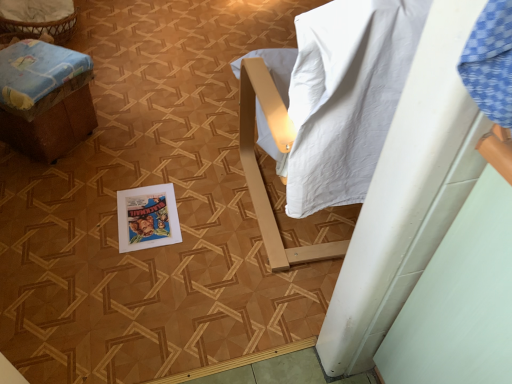
Question: Is point (125, 226) closer or farther from the camera than point (62, 122)?

Choices:
 (A) farther
 (B) closer

Answer: (B)

Question: Looking at their shapes, would you say vivid poster at center is wider or thinner than brown cardboard box at left?

Choices:
 (A) thin
 (B) wide

Answer: (A)

Question: Relative to brown cardboard box at left, is vivid poster at center in front or behind?

Choices:
 (A) behind
 (B) front

Answer: (A)

Question: Visually, is brown cardboard box at left positioned to the left or to the right of vivid poster at center?

Choices:
 (A) right
 (B) left

Answer: (B)

Question: Considering their positions, is brown cardboard box at left located in front of or behind vivid poster at center?

Choices:
 (A) front
 (B) behind

Answer: (A)

Question: From their relative heights in the image, would you say brown cardboard box at left is taller or shorter than vivid poster at center?

Choices:
 (A) tall
 (B) short

Answer: (A)

Question: Considering the positions of brown cardboard box at left and vivid poster at center in the image, is brown cardboard box at left wider or thinner than vivid poster at center?

Choices:
 (A) wide
 (B) thin

Answer: (A)